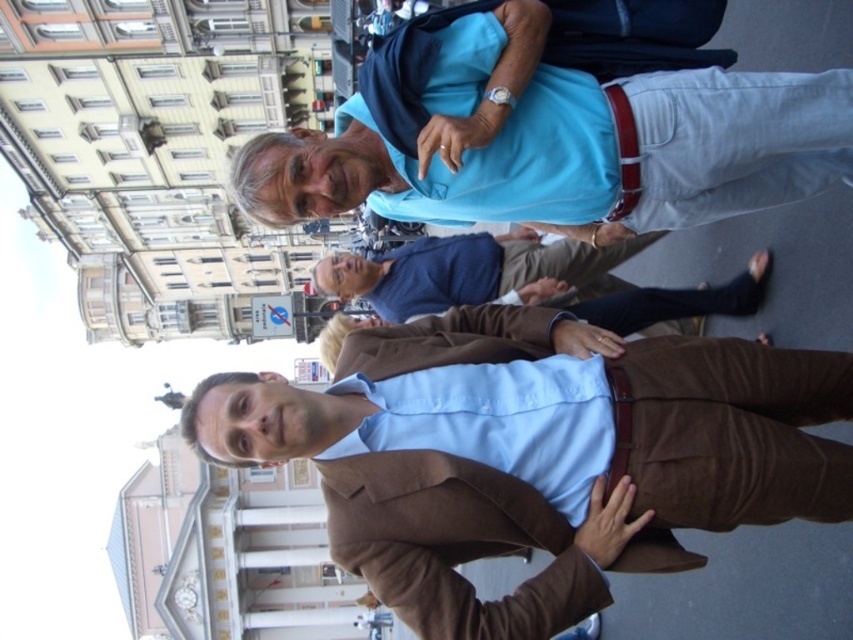
Question: Considering the real-world distances, which object is closest to the brown leather jacket at center?

Choices:
 (A) light blue fabric shirt at upper center
 (B) blue cotton shirt at center

Answer: (B)

Question: Does light blue fabric shirt at upper center have a greater width compared to blue cotton shirt at center?

Choices:
 (A) yes
 (B) no

Answer: (B)

Question: Can you confirm if light blue fabric shirt at upper center is bigger than blue cotton shirt at center?

Choices:
 (A) yes
 (B) no

Answer: (B)

Question: Which point is closer to the camera taking this photo?

Choices:
 (A) (467, 291)
 (B) (761, 260)
 (C) (283, 211)

Answer: (C)

Question: In this image, where is light blue fabric shirt at upper center located relative to brown leather jacket at center?

Choices:
 (A) left
 (B) right

Answer: (B)

Question: Among these points, which one is nearest to the camera?

Choices:
 (A) (466, 221)
 (B) (643, 308)
 (C) (463, 289)

Answer: (A)